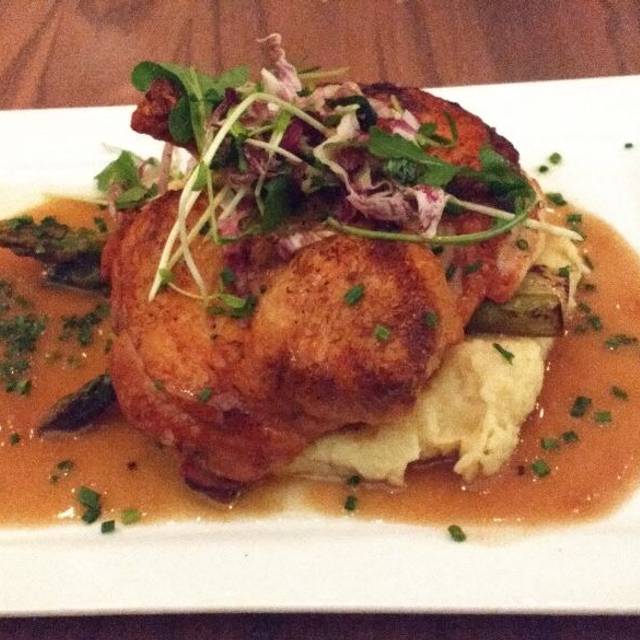
Where is `wooden table`? The width and height of the screenshot is (640, 640). wooden table is located at coordinates (582, 27), (525, 32).